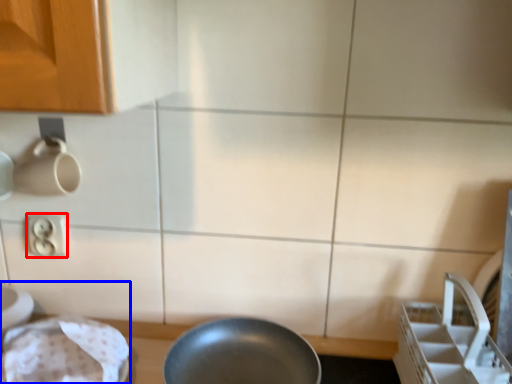
Question: Which of the following is the farthest to the observer, electric outlet (highlighted by a red box) or sink (highlighted by a blue box)?

Choices:
 (A) electric outlet
 (B) sink

Answer: (A)